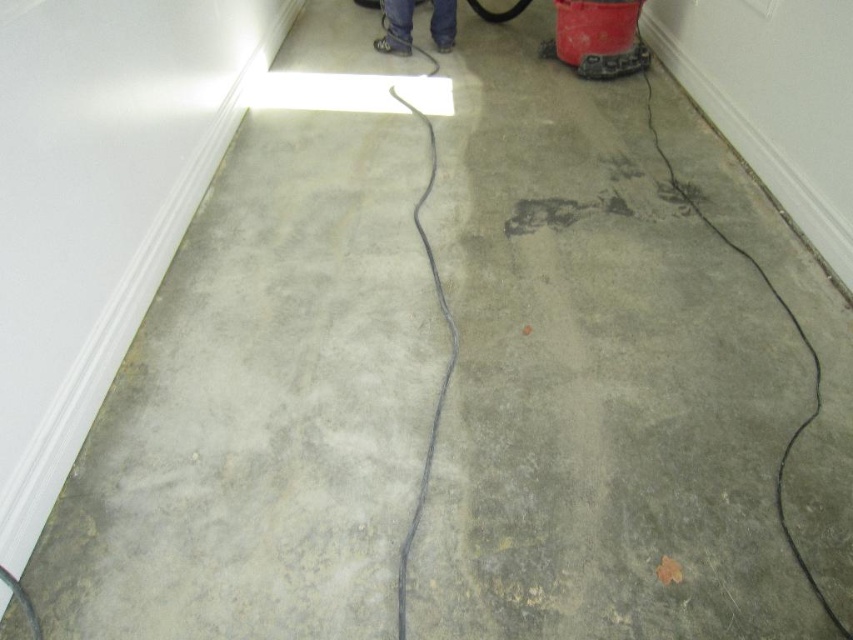
You are a GUI agent. You are given a task and a screenshot of the screen. Output one action in this format:
    pyautogui.click(x=<x>, y=<y>)
    Task: Click on the gray concrete crack at lower right
    The image size is (853, 640).
    Given the screenshot: What is the action you would take?
    pyautogui.click(x=804, y=346)

Between gray concrete crack at lower right and matte black shoes at center, which one is positioned lower?

gray concrete crack at lower right is lower down.

Is point (775, 499) farther from camera compared to point (447, 10)?

No.

Where is `gray concrete crack at lower right`? This screenshot has width=853, height=640. gray concrete crack at lower right is located at coordinates (804, 346).